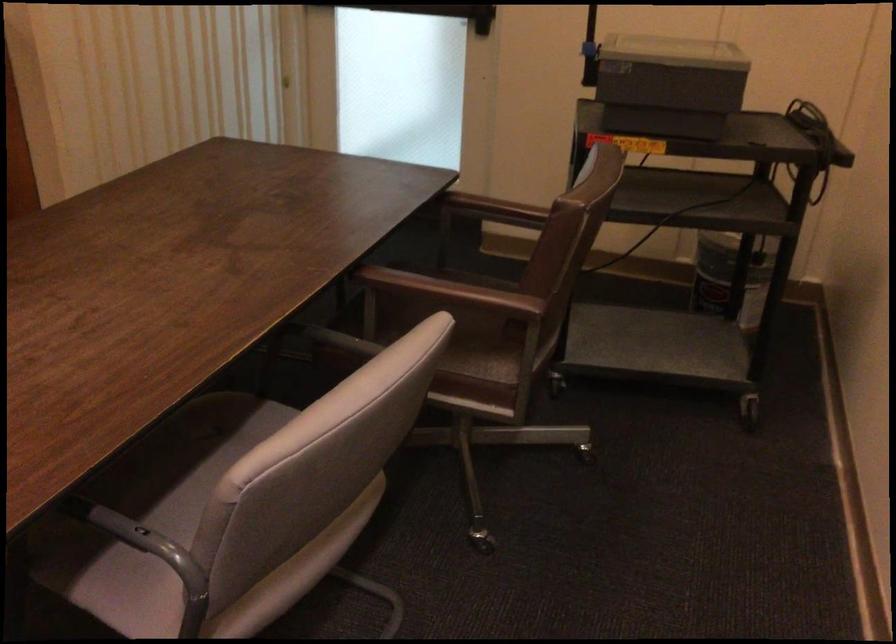
Image resolution: width=896 pixels, height=644 pixels. I want to click on grey chair sitting surface, so click(x=185, y=465).